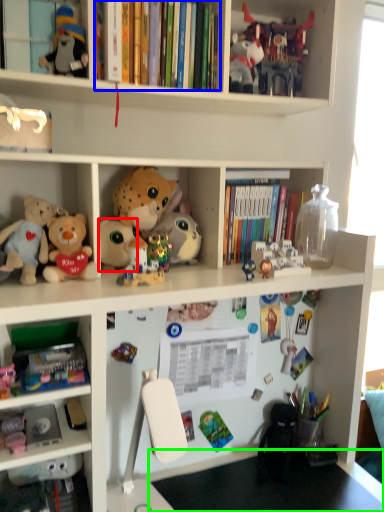
Question: Estimate the real-world distances between objects in this image. Which object is farther from toy (highlighted by a red box), book (highlighted by a blue box) or table (highlighted by a green box)?

Choices:
 (A) book
 (B) table

Answer: (B)